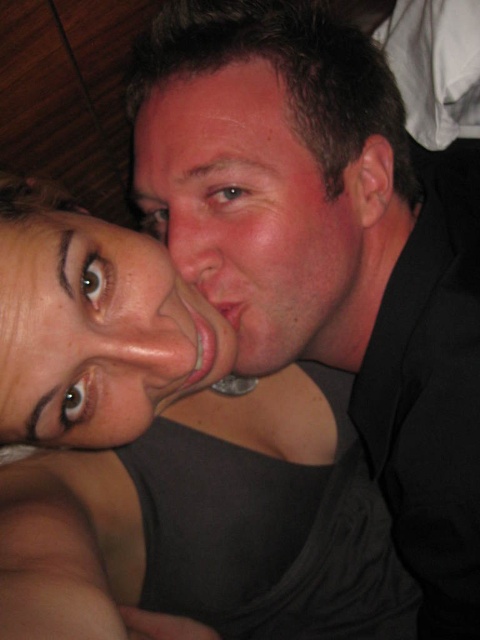
You are a photographer adjusting the focus on your camera. You notice the matte black tank top at center and the smooth skin face at center in your frame. Which object should you focus on to ensure the one closer to the camera is sharp?

The matte black tank top at center is in front of the smooth skin face at center, so you should focus on the matte black tank top at center to ensure the closer object is sharp.

You are a fashion designer observing two people in an image. You need to determine which piece of clothing is higher in the frame between the matte black shirt at upper right and the matte black tank top at center. Based on their positions, which one is taller?

The matte black shirt at upper right is taller than the matte black tank top at center according to the description.

You are a photographer adjusting the lighting for a portrait. You have two subjects in the frame, the matte black tank top at center and the smooth skin face at center. Which object should you focus on first if you want to ensure proper exposure, considering their size in the frame?

The matte black tank top at center is much taller than the smooth skin face at center, so you should focus on the matte black tank top at center first to ensure proper exposure since it occupies a larger portion of the frame.